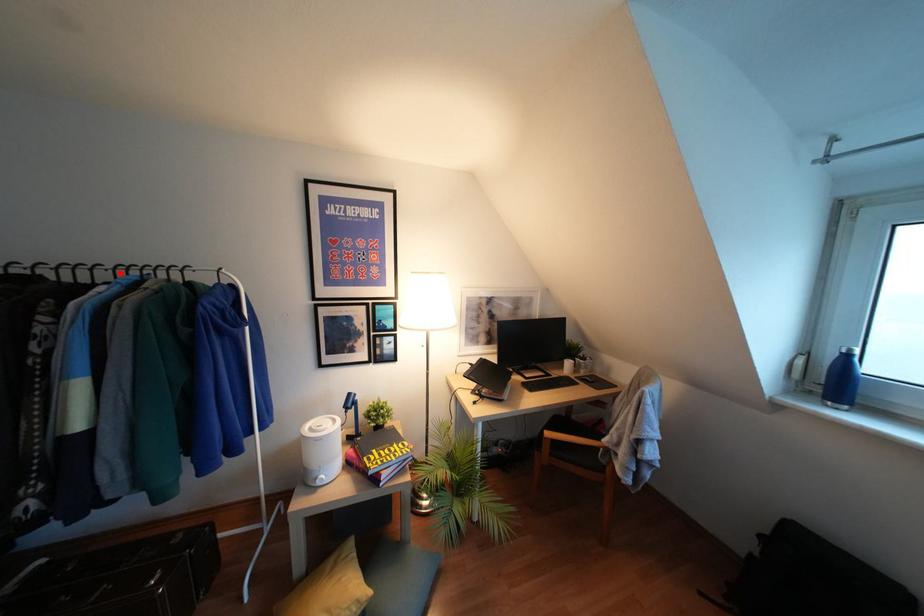
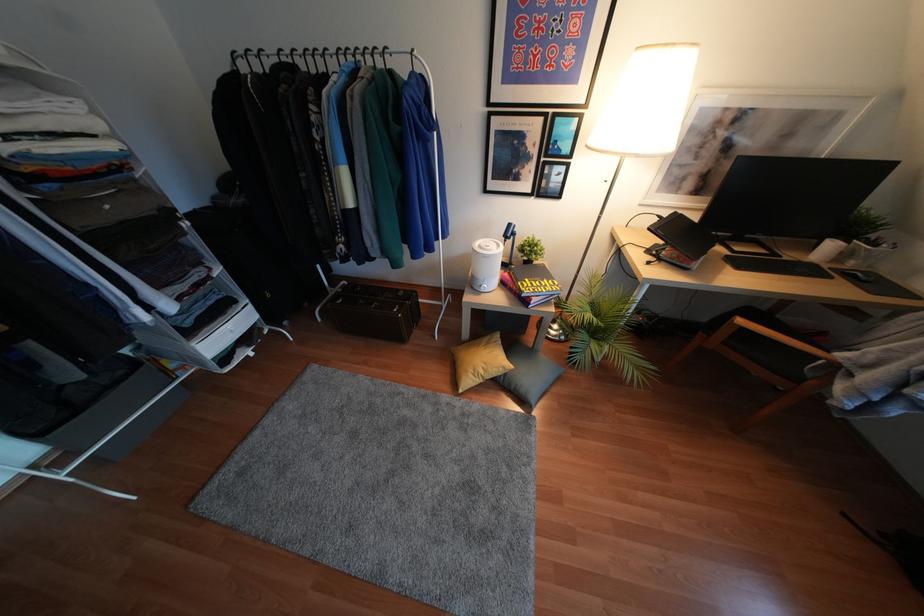
Where in the second image is the point corresponding to the highlighted location from the first image?

(342, 59)